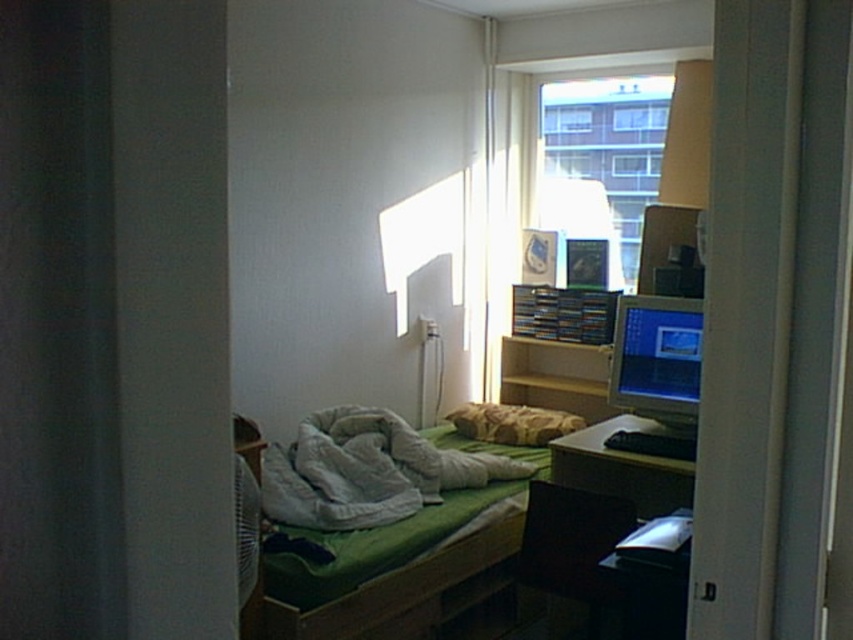
Who is shorter, transparent glass window at upper center or wooden desk at right?

Standing shorter between the two is wooden desk at right.

Is point (595, 157) closer to camera compared to point (660, 500)?

No, (595, 157) is further to viewer.

Image resolution: width=853 pixels, height=640 pixels. In order to click on transparent glass window at upper center in this screenshot , I will do `click(602, 160)`.

Does wooden desk at right have a greater width compared to patterned fabric pillow at center?

No, wooden desk at right is not wider than patterned fabric pillow at center.

Which is below, wooden desk at right or patterned fabric pillow at center?

wooden desk at right

Who is more distant from viewer, (607, 490) or (492, 424)?

The point (492, 424) is more distant.

This screenshot has height=640, width=853. I want to click on wooden desk at right, so click(x=622, y=467).

Can you confirm if matte silver monitor at right is thinner than patterned fabric pillow at center?

Yes.

Is the position of matte silver monitor at right more distant than that of patterned fabric pillow at center?

No, it is in front of patterned fabric pillow at center.

Who is more forward, (616,336) or (541,419)?

Point (616,336) is in front.

This screenshot has width=853, height=640. Identify the location of matte silver monitor at right. (657, 365).